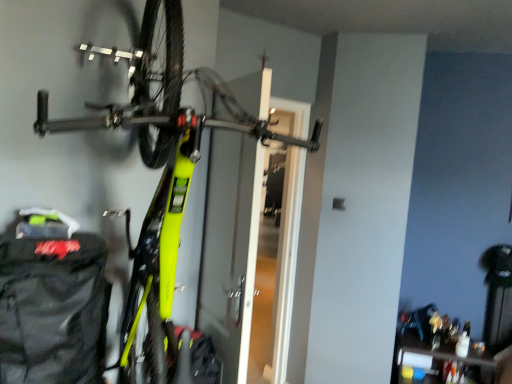
Question: Is black fabric backpack at lower left surrounded by neon yellow matte bicycle at center?

Choices:
 (A) no
 (B) yes

Answer: (B)

Question: Does neon yellow matte bicycle at center have a greater width compared to black fabric backpack at lower left?

Choices:
 (A) yes
 (B) no

Answer: (A)

Question: Is neon yellow matte bicycle at center with black fabric backpack at lower left?

Choices:
 (A) no
 (B) yes

Answer: (A)

Question: From the image's perspective, is neon yellow matte bicycle at center on top of black fabric backpack at lower left?

Choices:
 (A) no
 (B) yes

Answer: (B)

Question: Does neon yellow matte bicycle at center appear on the right side of black fabric backpack at lower left?

Choices:
 (A) no
 (B) yes

Answer: (B)

Question: Is neon yellow matte bicycle at center outside of black fabric backpack at lower left?

Choices:
 (A) no
 (B) yes

Answer: (B)

Question: Is black fabric backpack at lower left thinner than neon yellow matte bicycle at center?

Choices:
 (A) no
 (B) yes

Answer: (B)

Question: Would you say black fabric backpack at lower left contains neon yellow matte bicycle at center?

Choices:
 (A) yes
 (B) no

Answer: (B)

Question: Considering the relative sizes of black fabric backpack at lower left and neon yellow matte bicycle at center in the image provided, is black fabric backpack at lower left bigger than neon yellow matte bicycle at center?

Choices:
 (A) no
 (B) yes

Answer: (A)

Question: Can you confirm if black fabric backpack at lower left is positioned to the left of neon yellow matte bicycle at center?

Choices:
 (A) no
 (B) yes

Answer: (B)

Question: Can you confirm if black fabric backpack at lower left is taller than neon yellow matte bicycle at center?

Choices:
 (A) no
 (B) yes

Answer: (A)

Question: Can you confirm if black fabric backpack at lower left is shorter than neon yellow matte bicycle at center?

Choices:
 (A) yes
 (B) no

Answer: (A)

Question: In the image, is neon yellow matte bicycle at center on the left side or the right side of black fabric backpack at lower left?

Choices:
 (A) left
 (B) right

Answer: (B)